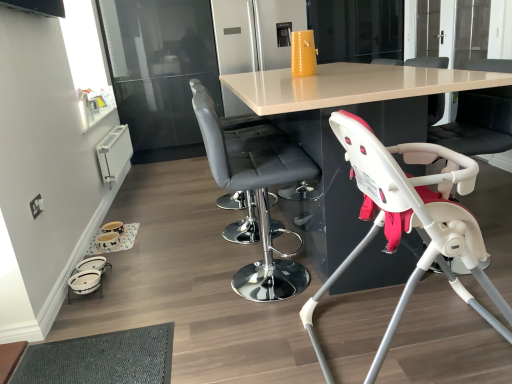
In order to click on vacant space underneath white plastic highchair at lower right, acting as the 1th chair starting from the front (from a real-world perspective) in this screenshot , I will do `click(420, 345)`.